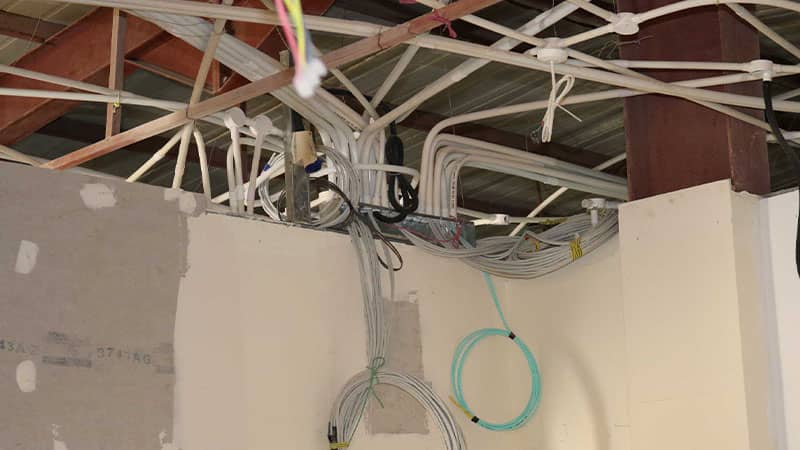
You are a GUI agent. You are given a task and a screenshot of the screen. Output one action in this format:
    pyautogui.click(x=<x>, y=<y>)
    Task: Click on the white spots on wall
    
    Given the screenshot: What is the action you would take?
    pyautogui.click(x=90, y=197), pyautogui.click(x=26, y=258), pyautogui.click(x=25, y=369)